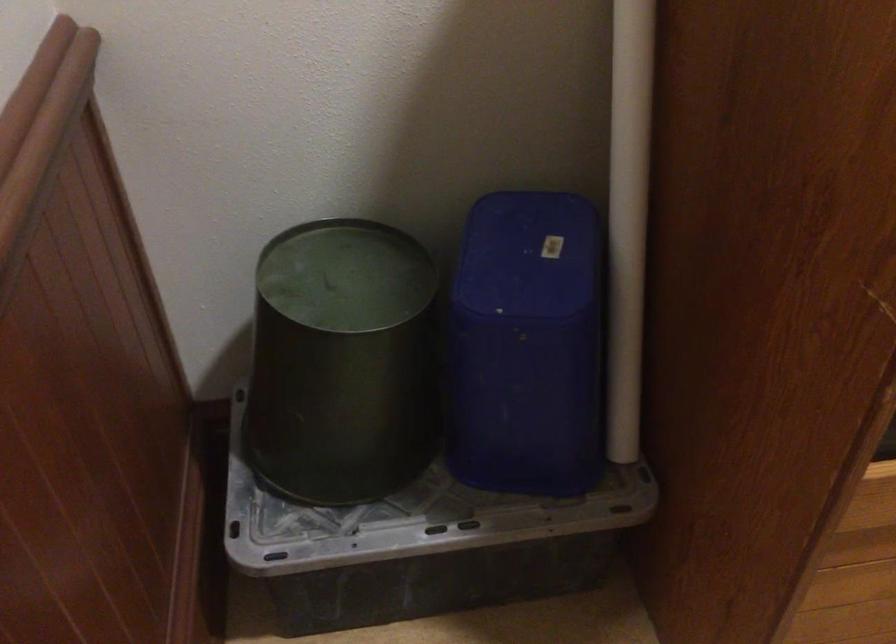
Find the location of a particular element. blue container lid is located at coordinates (529, 254).